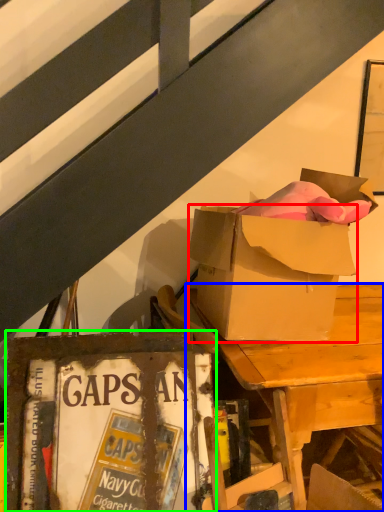
Question: Which is nearer to the box (highlighted by a red box)? desk (highlighted by a blue box) or paperback book (highlighted by a green box).

Choices:
 (A) desk
 (B) paperback book

Answer: (A)